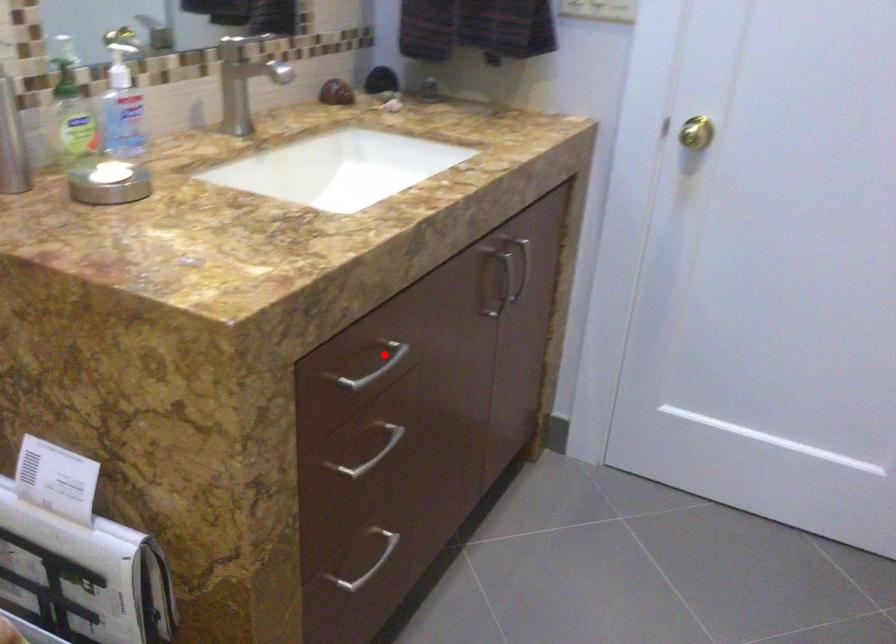
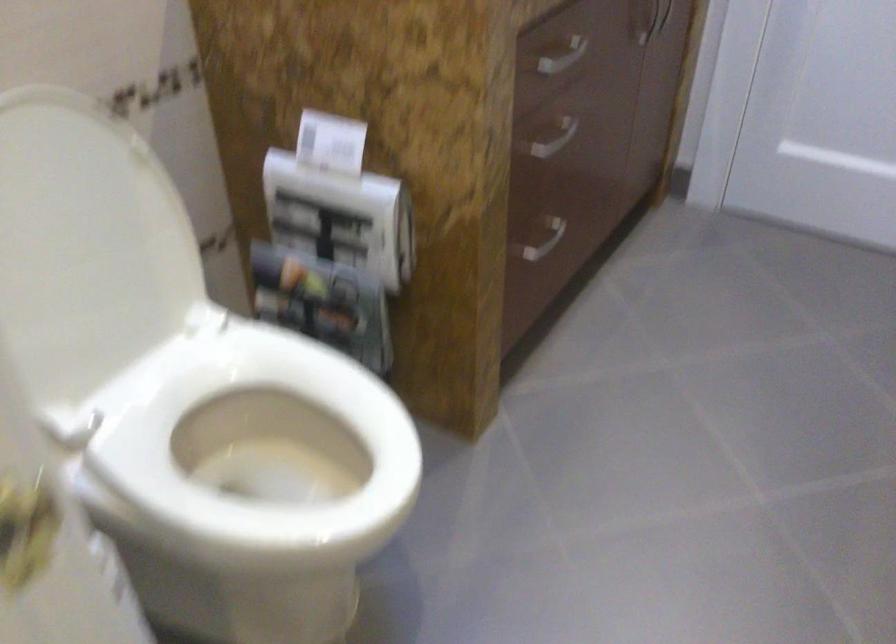
Question: A red point is marked in image1. In image2, is the corresponding 3D point closer to the camera or farther? Reply with the corresponding letter.

Choices:
 (A) The corresponding 3D point is closer.
 (B) The corresponding 3D point is farther.

Answer: (B)